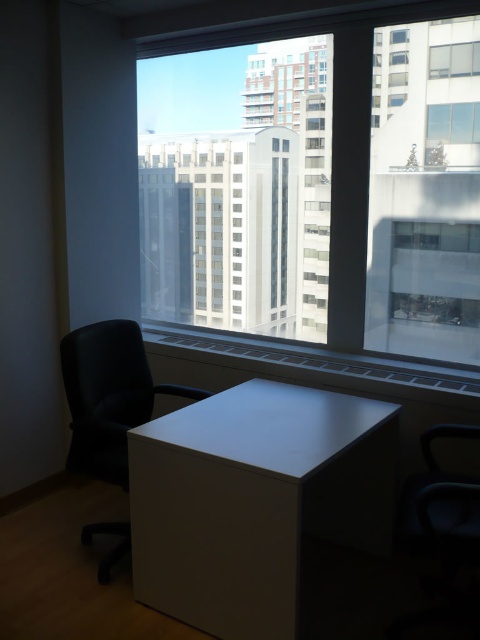
You are a delivery robot with a height of 1.8 meters. You are entering this office and need to deliver a package to the desk. The transparent glass window at center is in your path. Can you pass under the window without hitting your head?

The transparent glass window at center is 2.51 meters from the camera, which is higher than your height of 1.8 meters. Therefore, you can safely pass under the transparent glass window at center without hitting your head.

You are an office worker who wants to enjoy the city view while working. You have a black leather swivel chair at left and a transparent glass window at upper center. Can you rotate the chair to face the window and have a clear view of the city?

The black leather swivel chair at left is positioned under the transparent glass window at upper center, so yes, you can rotate the chair to face the window and have a clear view of the city.

You are organizing the office and need to place a tall plant that requires a stable base. Which object between the white matte cabinet at center and the black leather swivel chair at left would be more suitable to place the plant on?

The white matte cabinet at center has a greater height compared to the black leather swivel chair at left, so it would provide a more stable base for the tall plant.